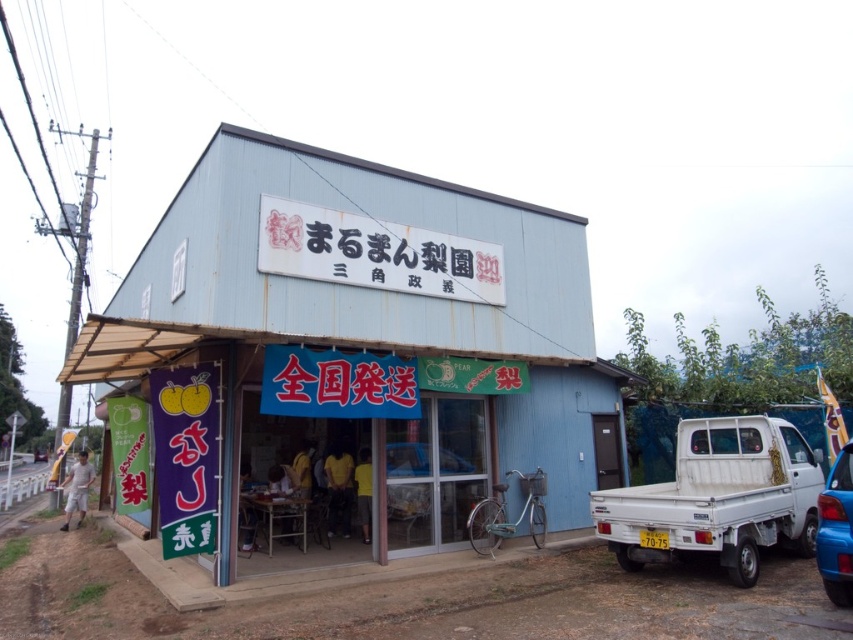
Consider the image. Can you confirm if blue corrugated metal hut at center is positioned below blue glossy car at lower right?

No, blue corrugated metal hut at center is not below blue glossy car at lower right.

Image resolution: width=853 pixels, height=640 pixels. What do you see at coordinates (357, 355) in the screenshot? I see `blue corrugated metal hut at center` at bounding box center [357, 355].

Is point (486, 484) positioned before point (822, 529)?

No.

The width and height of the screenshot is (853, 640). I want to click on blue corrugated metal hut at center, so click(x=357, y=355).

Does blue corrugated metal hut at center have a lesser width compared to white matte truck at right?

Incorrect, blue corrugated metal hut at center's width is not less than white matte truck at right's.

Is point (328, 404) more distant than point (624, 538)?

No.

I want to click on blue corrugated metal hut at center, so click(357, 355).

Is blue corrugated metal hut at center smaller than white matte signboard at center?

Actually, blue corrugated metal hut at center might be larger than white matte signboard at center.

Is blue corrugated metal hut at center bigger than white matte signboard at center?

Yes, blue corrugated metal hut at center is bigger than white matte signboard at center.

Between point (161, 216) and point (468, 256), which one is positioned in front?

Positioned in front is point (468, 256).

Identify the location of blue corrugated metal hut at center. (357, 355).